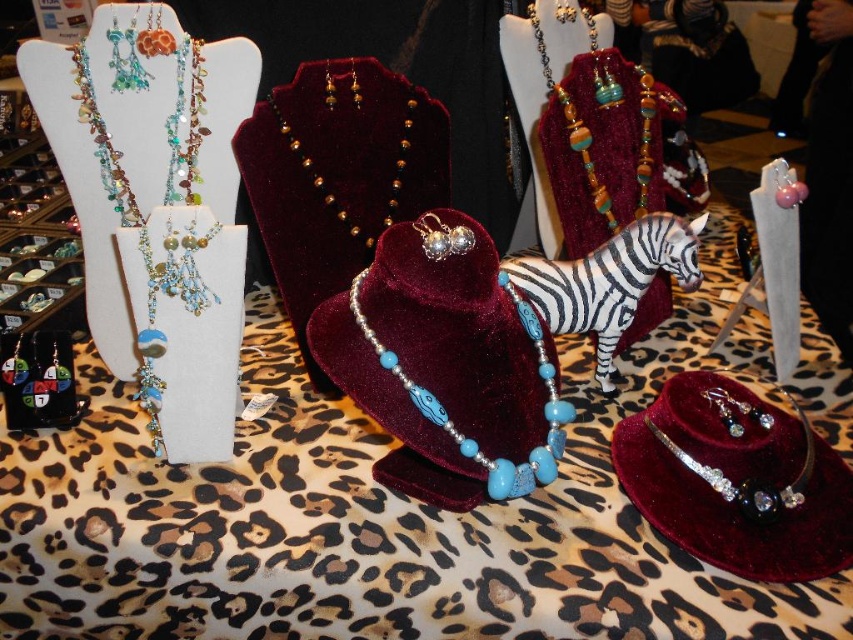
You are a customer looking at the jewelry display. You want to know which necklace is positioned to the left between the matte blue beaded necklace at left and the gold beaded necklace at center. Which one is more to the left?

The matte blue beaded necklace at left is positioned to the left of the gold beaded necklace at center, so the matte blue beaded necklace at left is more to the left.

You are a customer looking to purchase a necklace. You see the turquoise glass beads at center and the swarovski crystal bracelet at center. Which one is placed higher?

The turquoise glass beads at center is positioned over the swarovski crystal bracelet at center, so it is placed higher.

You are a customer who wants to examine the swarovski crystal bracelet at center. Based on the scene description, can you estimate how far you need to step forward to get a closer look at the bracelet?

The swarovski crystal bracelet at center is 38.25 inches from viewer. To get a closer look, you would need to step forward approximately 38.25 inches, which is about 3.19 feet or just over 1 meter.